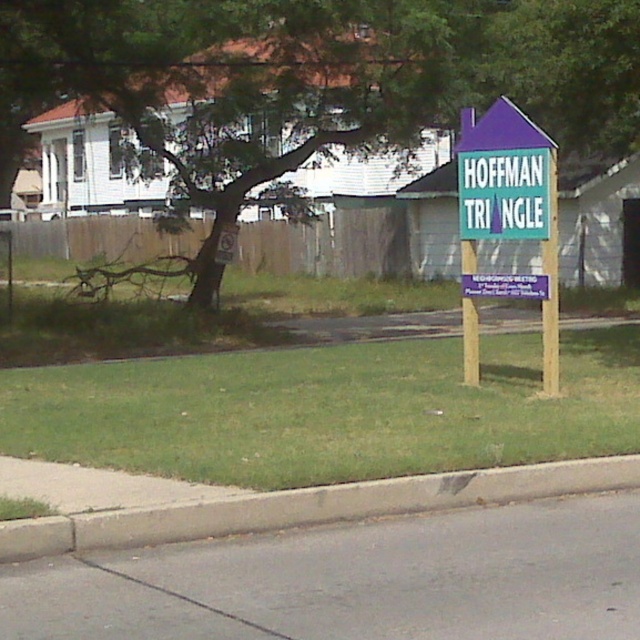
Which is behind, point (125, 524) or point (550, 321)?

The point (550, 321) is behind.

The width and height of the screenshot is (640, 640). Describe the element at coordinates (308, 506) in the screenshot. I see `concrete at lower left` at that location.

What do you see at coordinates (308, 506) in the screenshot? This screenshot has height=640, width=640. I see `concrete at lower left` at bounding box center [308, 506].

Image resolution: width=640 pixels, height=640 pixels. Find the location of `concrete at lower left`. concrete at lower left is located at coordinates click(308, 506).

Consider the image. Which is more to the right, green grass at center or purple wood signpost at center?

purple wood signpost at center is more to the right.

Between point (570, 412) and point (470, 342), which one is positioned behind?

The point (470, 342) is more distant.

Identify the location of green grass at center. (328, 410).

I want to click on green grass at center, so click(x=328, y=410).

What do you see at coordinates (328, 410) in the screenshot? I see `green grass at center` at bounding box center [328, 410].

Describe the element at coordinates (328, 410) in the screenshot. I see `green grass at center` at that location.

In order to click on green grass at center in this screenshot , I will do `click(328, 410)`.